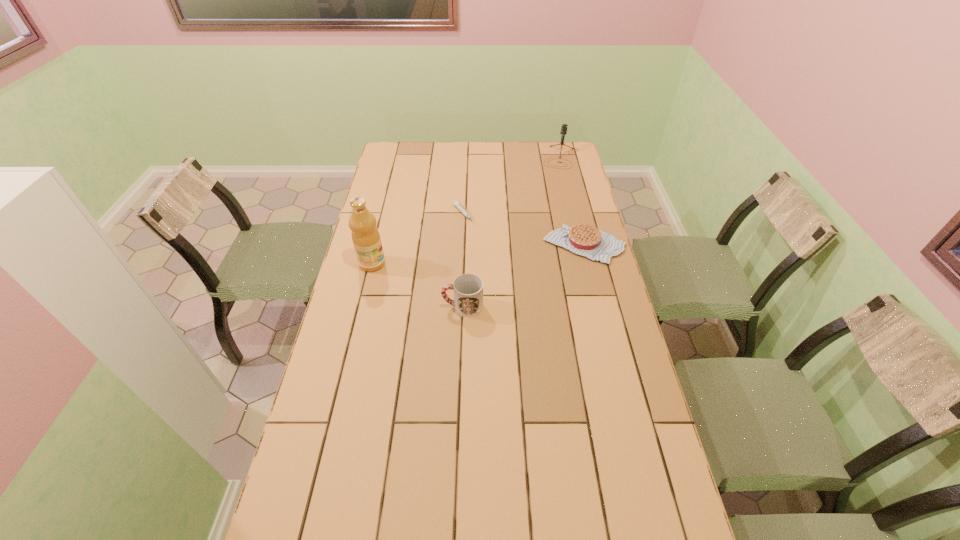
The image size is (960, 540). What are the coordinates of `the nearest object` in the screenshot? It's located at (468, 288).

Locate an element on the screen. the fourth tallest object is located at coordinates (586, 240).

Identify the location of olive oil. (365, 235).

What are the coordinates of `the tallest object` in the screenshot? It's located at (365, 235).

You are a GUI agent. You are given a task and a screenshot of the screen. Output one action in this format:
    pyautogui.click(x=<x>, y=<y>)
    Task: Click on the microphone
    
    Given the screenshot: What is the action you would take?
    pyautogui.click(x=564, y=126)

The height and width of the screenshot is (540, 960). What are the coordinates of `syringe` in the screenshot? It's located at (456, 203).

Identify the location of vacant space situated 0.310m on the side of the cup where the handle is located. tap(349, 307).

This screenshot has width=960, height=540. In order to click on blank space located 0.180m on the side of the cup where the handle is located in this screenshot , I will do `click(389, 307)`.

The height and width of the screenshot is (540, 960). In order to click on free point located on the side of the cup where the handle is located in this screenshot , I will do `click(382, 307)`.

Where is `free spot located on the left of the pie`? free spot located on the left of the pie is located at coordinates (438, 245).